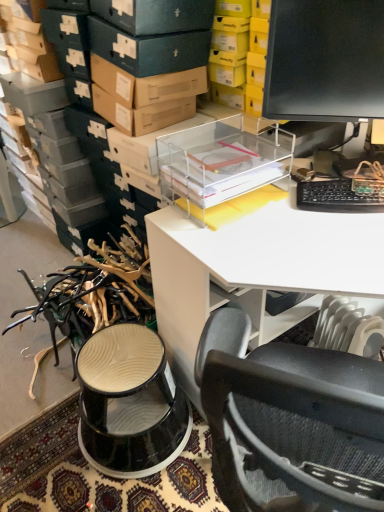
Where is `blank space situated above black plastic keyboard at right (from a real-world perspective)`? blank space situated above black plastic keyboard at right (from a real-world perspective) is located at coordinates (347, 188).